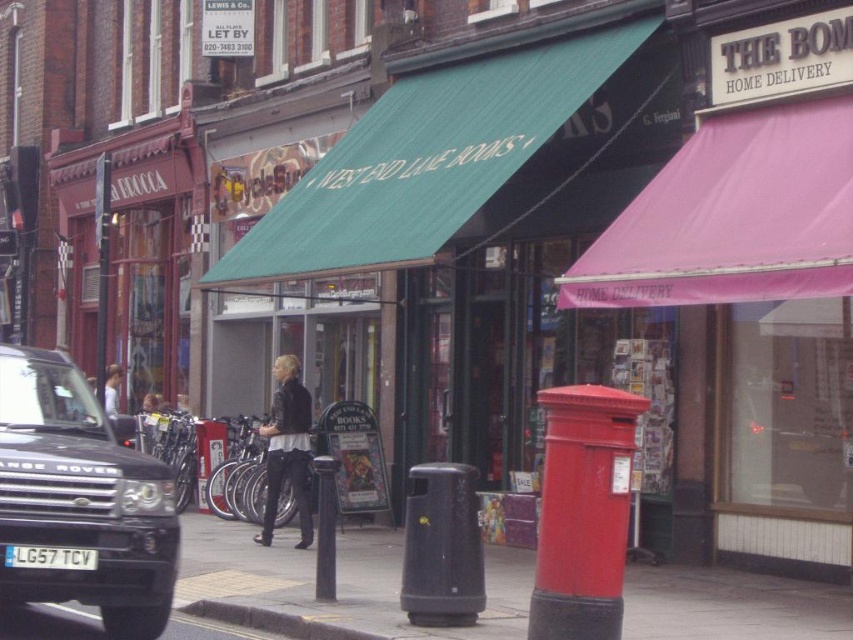
You are a delivery driver who needs to park your vehicle between the yellow painted concrete curb at lower center and the white plastic license plate at lower left. Can you fit your vehicle if it is 2 meters wide?

The yellow painted concrete curb at lower center is wider than the white plastic license plate at lower left. However, the exact width of the space between them isn

Consider the image. You are a delivery driver who needs to park your van between the yellow painted concrete curb at lower center and the white plastic license plate at lower left. Your van is 12 feet long. Is there enough space between them to park?

The distance between the yellow painted concrete curb at lower center and the white plastic license plate at lower left is 7.55 feet. Since your van is 12 feet long, there isn not enough space to park between them.

You are standing at the edge of the street in the scene. You need to walk to the black asphalt pavement at lower center to retrieve an item you dropped there. Approximately how many steps would you need to take if each step covers about 3 feet?

The black asphalt pavement at lower center is 30.96 feet away from the viewer. Since each step covers about 3 feet, dividing 30.96 by 3 gives approximately 10.32 steps. Therefore, you would need to take around 10 to 11 steps to reach the black asphalt pavement at lower center.